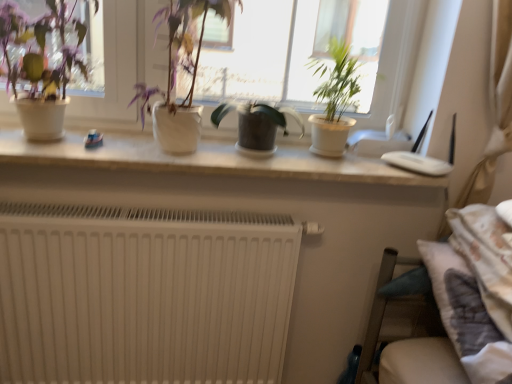
Identify the location of vacant space situated above white matte radiator at lower left (from a real-world perspective). The width and height of the screenshot is (512, 384). (151, 209).